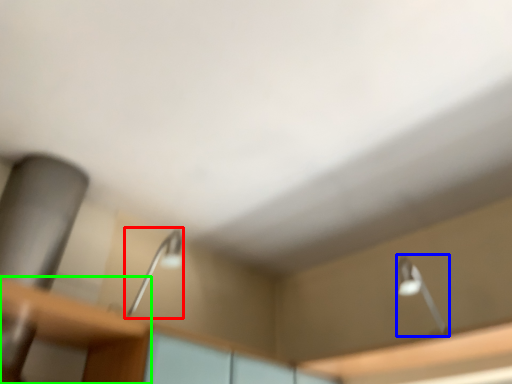
Question: Estimate the real-world distances between objects in this image. Which object is farther from lamp (highlighted by a red box), lamp (highlighted by a blue box) or table (highlighted by a green box)?

Choices:
 (A) lamp
 (B) table

Answer: (A)